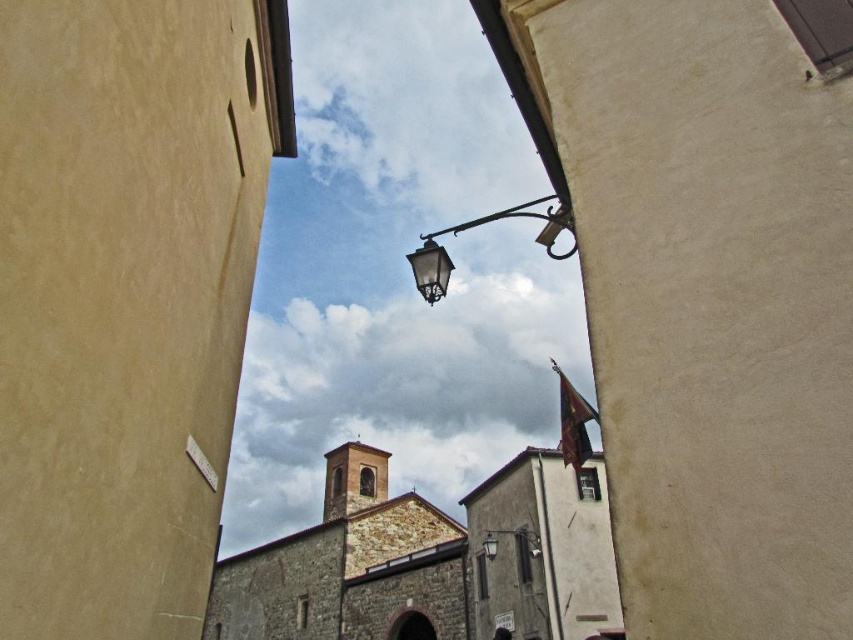
You are a delivery person trying to navigate through the narrow street. The metallic streetlamp at center is blocking your path. Can you pass under it without hitting the dark gray stone archway at center?

The dark gray stone archway at center is positioned under the metallic streetlamp at center, so passing under the streetlamp would mean going under the archway as well. Therefore, you can pass under the metallic streetlamp at center without hitting the dark gray stone archway at center since they are aligned vertically.

In the scene shown: You are standing on the narrow street scene and want to walk from point A to point B. Point A is at coordinates point [427,627] and point B is at coordinates point [531,554]. According to the scene, which point is closer to you?

Point [427,627] is further to the camera than point [531,554]. Therefore, point [531,554] is closer to you.